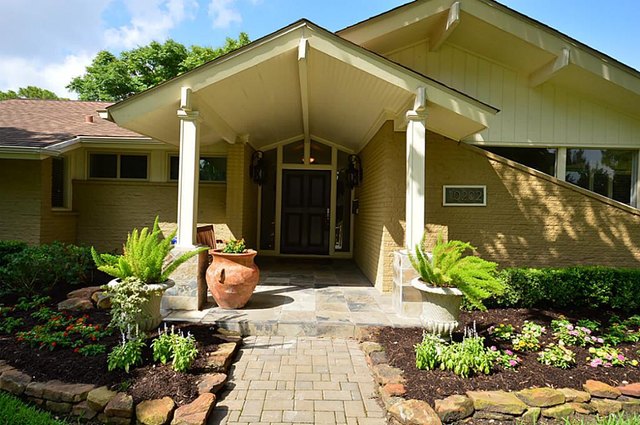
You are a GUI agent. You are given a task and a screenshot of the screen. Output one action in this format:
    pyautogui.click(x=<x>, y=<y>)
    Task: Click on the light
    This screenshot has width=640, height=425.
    Given the screenshot: What is the action you would take?
    pyautogui.click(x=312, y=159)